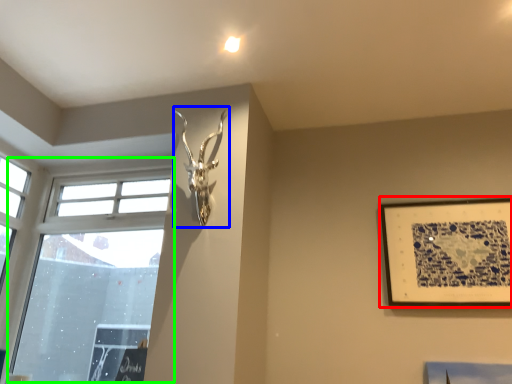
Question: Which object is positioned closest to picture frame (highlighted by a red box)? Select from sculpture (highlighted by a blue box) and window (highlighted by a green box).

Choices:
 (A) sculpture
 (B) window

Answer: (A)